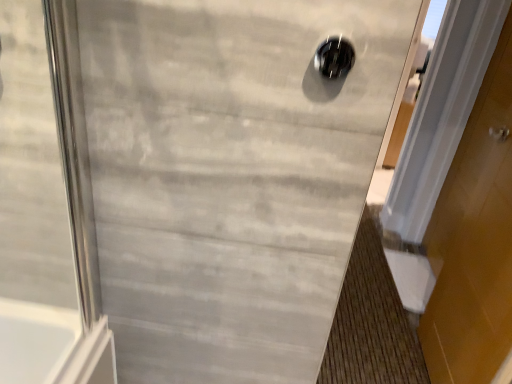
The width and height of the screenshot is (512, 384). What do you see at coordinates (334, 57) in the screenshot?
I see `black glossy hole at upper center` at bounding box center [334, 57].

The image size is (512, 384). In order to click on black glossy hole at upper center in this screenshot , I will do `click(334, 57)`.

The height and width of the screenshot is (384, 512). I want to click on white wood door at right, so click(x=474, y=240).

What is the approximate width of white wood door at right?

white wood door at right is 3.50 inches wide.

The height and width of the screenshot is (384, 512). What do you see at coordinates (474, 240) in the screenshot? I see `white wood door at right` at bounding box center [474, 240].

The width and height of the screenshot is (512, 384). Find the location of `black glossy hole at upper center`. black glossy hole at upper center is located at coordinates (334, 57).

Between black glossy hole at upper center and white wood door at right, which one appears on the left side from the viewer's perspective?

From the viewer's perspective, black glossy hole at upper center appears more on the left side.

From the picture: Is black glossy hole at upper center positioned in front of white wood door at right?

Yes, black glossy hole at upper center is in front of white wood door at right.

Does point (324, 50) come in front of point (488, 113)?

Yes, it is in front of point (488, 113).

From the image's perspective, is black glossy hole at upper center positioned above or below white wood door at right?

black glossy hole at upper center is situated higher than white wood door at right in the image.

From a real-world perspective, who is located lower, black glossy hole at upper center or white wood door at right?

In real-world perspective, white wood door at right is lower.

Is black glossy hole at upper center wider than white wood door at right?

Incorrect, the width of black glossy hole at upper center does not surpass that of white wood door at right.

Is black glossy hole at upper center shorter than white wood door at right?

Indeed, black glossy hole at upper center has a lesser height compared to white wood door at right.

Considering the relative sizes of black glossy hole at upper center and white wood door at right in the image provided, is black glossy hole at upper center smaller than white wood door at right?

Yes.

Is white wood door at right located within black glossy hole at upper center?

No, black glossy hole at upper center does not contain white wood door at right.

Is black glossy hole at upper center far away from white wood door at right?

Indeed, black glossy hole at upper center is not near white wood door at right.

Could you tell me if black glossy hole at upper center is turned towards white wood door at right?

No, black glossy hole at upper center is not facing towards white wood door at right.

How many degrees apart are the facing directions of black glossy hole at upper center and white wood door at right?

black glossy hole at upper center and white wood door at right are facing 92.3 degrees away from each other.

The height and width of the screenshot is (384, 512). Identify the location of door below the black glossy hole at upper center (from a real-world perspective). (474, 240).

Between white wood door at right and black glossy hole at upper center, which one appears on the right side from the viewer's perspective?

white wood door at right is more to the right.

Between white wood door at right and black glossy hole at upper center, which one is positioned behind?

white wood door at right is further from the camera.

Does point (443, 247) come farther from viewer compared to point (323, 66)?

Yes, it is.

Looking at this image, from the image's perspective, is white wood door at right on top of black glossy hole at upper center?

Actually, white wood door at right appears below black glossy hole at upper center in the image.

From a real-world perspective, which is physically above, white wood door at right or black glossy hole at upper center?

From a 3D spatial view, black glossy hole at upper center is above.

Considering the sizes of white wood door at right and black glossy hole at upper center in the image, is white wood door at right wider or thinner than black glossy hole at upper center?

In the image, white wood door at right appears to be wider than black glossy hole at upper center.

Who is taller, white wood door at right or black glossy hole at upper center?

Standing taller between the two is white wood door at right.

Based on their sizes in the image, would you say white wood door at right is bigger or smaller than black glossy hole at upper center?

white wood door at right is bigger than black glossy hole at upper center.

Can black glossy hole at upper center be found inside white wood door at right?

No, black glossy hole at upper center is not surrounded by white wood door at right.

Is white wood door at right with black glossy hole at upper center?

They are not placed beside each other.

Could you tell me if white wood door at right is turned towards black glossy hole at upper center?

No, white wood door at right is not facing towards black glossy hole at upper center.

At what (x,y) coordinates should I click in order to perform the action: click on door below the black glossy hole at upper center (from a real-world perspective). Please return your answer as a coordinate pair (x, y). The height and width of the screenshot is (384, 512). Looking at the image, I should click on (474, 240).

The image size is (512, 384). I want to click on hole above the white wood door at right (from a real-world perspective), so tap(334, 57).

In order to click on door behind the black glossy hole at upper center in this screenshot , I will do click(x=474, y=240).